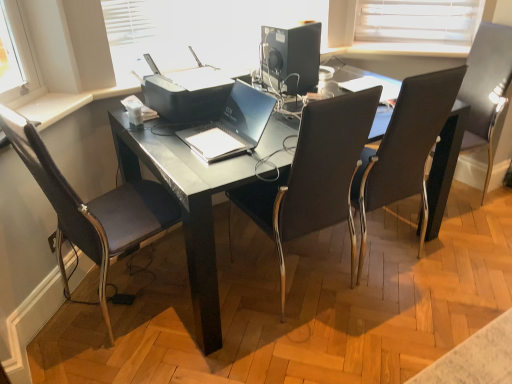
Question: From the image's perspective, is black leather chair at center, which is the third chair in right-to-left order, above or below black leather chair at center, placed as the third chair when sorted from left to right?

Choices:
 (A) below
 (B) above

Answer: (A)

Question: Is point tap(293, 177) positioned closer to the camera than point tap(354, 198)?

Choices:
 (A) closer
 (B) farther

Answer: (A)

Question: Considering the real-world distances, which object is farthest from the black plastic desktop computer at upper center?

Choices:
 (A) black glossy desk at center
 (B) dark brown leather chair at left, the 4th chair positioned from the right
 (C) satin black laptop at center
 (D) black leather chair at center, which is the third chair in right-to-left order
 (E) matte plastic printer at upper center

Answer: (B)

Question: Based on their relative distances, which object is nearer to the black leather chair at upper right, acting as the 4th chair starting from the left?

Choices:
 (A) black leather chair at center, which appears as the second chair when viewed from the right
 (B) matte plastic printer at upper center
 (C) black leather chair at center, arranged as the 2th chair when viewed from the left
 (D) black plastic desktop computer at upper center
 (E) black glossy desk at center

Answer: (A)